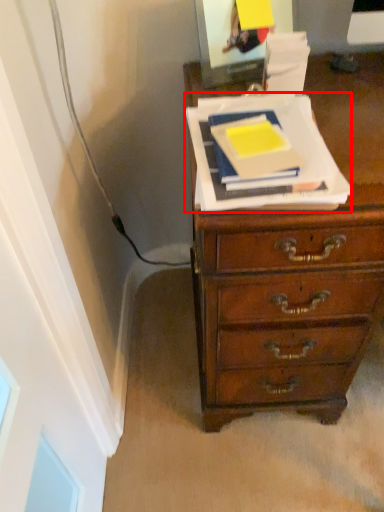
Question: From the image's perspective, where is paperback book (annotated by the red box) located in relation to paperback book in the image?

Choices:
 (A) below
 (B) above

Answer: (A)